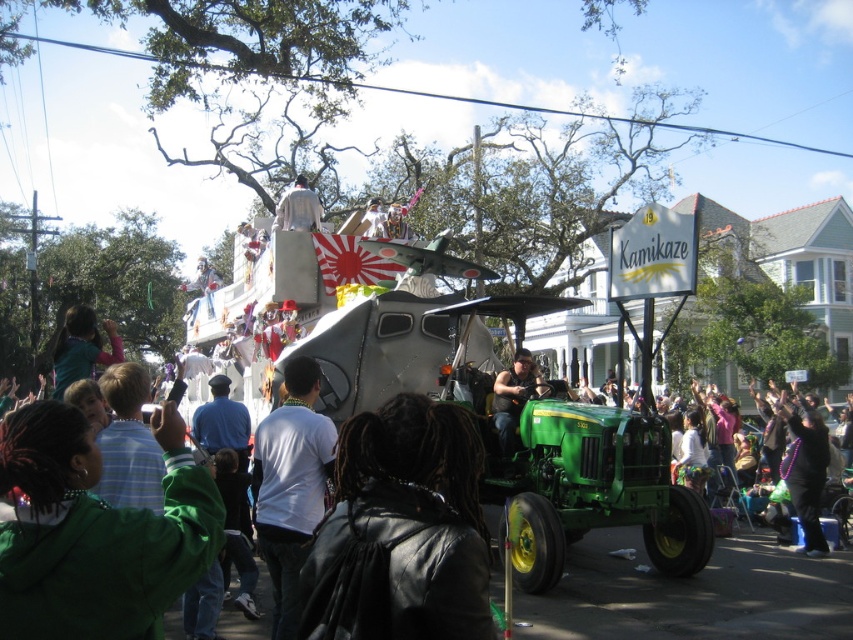
Question: In this image, where is black leather jacket at center located relative to green fabric shirt at lower left?

Choices:
 (A) right
 (B) left

Answer: (A)

Question: Which point is closer to the camera?

Choices:
 (A) white shirt at center
 (B) green matte jacket at lower left
 (C) matte black shirt at center
 (D) green fabric shirt at lower left

Answer: (B)

Question: Observing the image, what is the correct spatial positioning of green matte jacket at lower left in reference to white fabric at upper center?

Choices:
 (A) left
 (B) right

Answer: (A)

Question: Among these points, which one is farthest from the camera?

Choices:
 (A) (77, 378)
 (B) (289, 404)
 (C) (825, 540)

Answer: (A)

Question: Which object is farther from the camera taking this photo?

Choices:
 (A) matte black shirt at center
 (B) black leather jacket at center
 (C) green matte tractor at center

Answer: (A)

Question: Is green matte jacket at lower left positioned at the back of green fabric shirt at lower left?

Choices:
 (A) no
 (B) yes

Answer: (A)